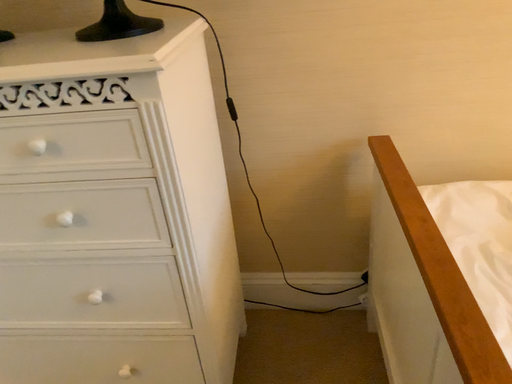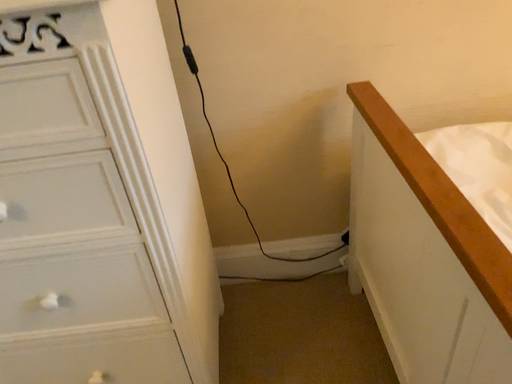
Question: How did the camera likely rotate when shooting the video?

Choices:
 (A) rotated left
 (B) rotated right

Answer: (B)